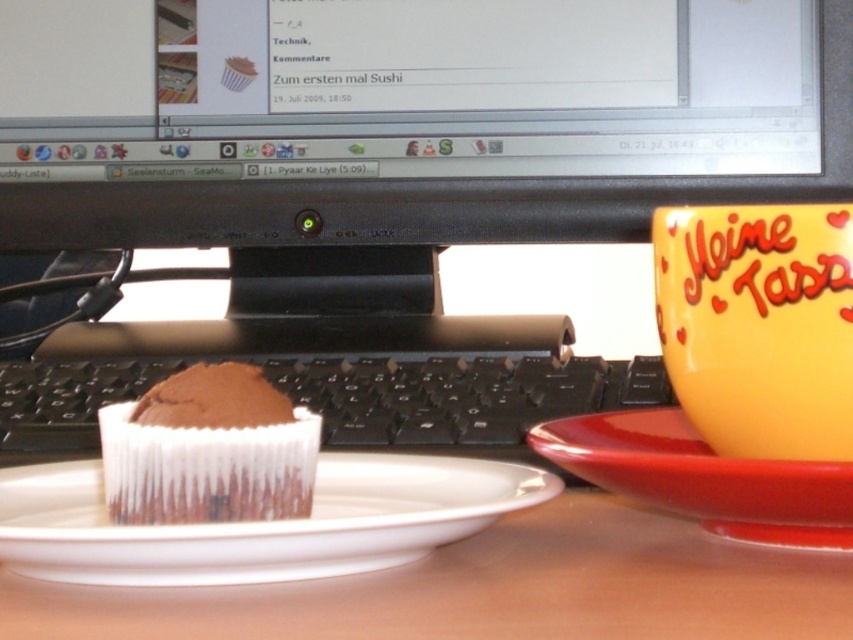
Question: From the image, what is the correct spatial relationship of black plastic keyboard at center in relation to matte ceramic saucer at right?

Choices:
 (A) right
 (B) left

Answer: (B)

Question: Which of these objects is positioned closest to the black plastic keyboard at center?

Choices:
 (A) chocolate frosted cupcake at center
 (B) white glossy plate at center
 (C) matte white plate at center
 (D) yellow matte mug at right

Answer: (B)

Question: Which object appears closest to the camera in this image?

Choices:
 (A) matte white plate at center
 (B) matte ceramic saucer at right
 (C) white glossy plate at center

Answer: (A)

Question: Among these points, which one is nearest to the camera?

Choices:
 (A) (781, 404)
 (B) (344, 435)
 (C) (763, 61)
 (D) (764, 636)

Answer: (D)

Question: Is matte black monitor at center behind black plastic keyboard at center?

Choices:
 (A) yes
 (B) no

Answer: (A)

Question: Is matte black monitor at center to the left of matte white plate at center from the viewer's perspective?

Choices:
 (A) yes
 (B) no

Answer: (A)